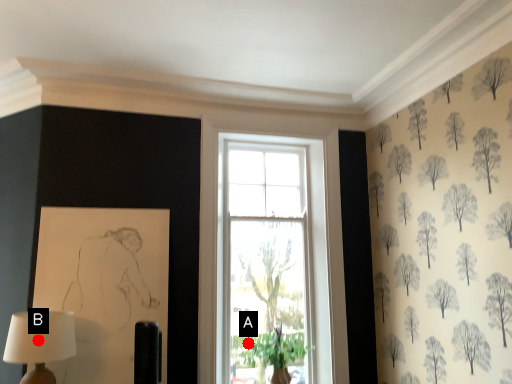
Question: Two points are circled on the image, labeled by A and B beside each circle. Among these points, which one is nearest to the camera?

Choices:
 (A) A is closer
 (B) B is closer

Answer: (B)